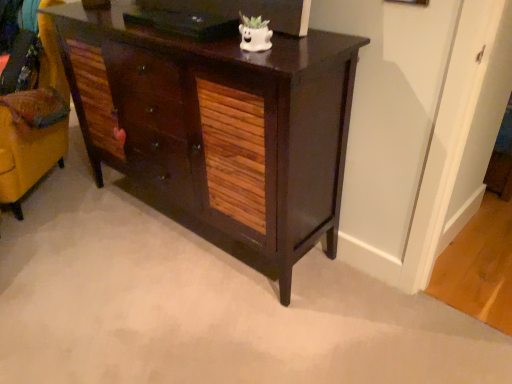
This screenshot has height=384, width=512. In order to click on velvet yellow swivel chair at left in this screenshot , I will do (x=33, y=129).

The width and height of the screenshot is (512, 384). What do you see at coordinates (33, 129) in the screenshot?
I see `velvet yellow swivel chair at left` at bounding box center [33, 129].

Measure the distance between point (x=9, y=138) and camera.

A distance of 6.69 feet exists between point (x=9, y=138) and camera.

Describe the element at coordinates (218, 122) in the screenshot. I see `dark wood cabinet at center` at that location.

Measure the distance between point (x=277, y=97) and camera.

Point (x=277, y=97) is 1.30 meters away from camera.

This screenshot has height=384, width=512. Find the location of `dark wood cabinet at center`. dark wood cabinet at center is located at coordinates (218, 122).

This screenshot has height=384, width=512. Find the location of `velvet yellow swivel chair at left`. velvet yellow swivel chair at left is located at coordinates (33, 129).

Does velvet yellow swivel chair at left appear on the right side of dark wood cabinet at center?

No.

Who is more distant, velvet yellow swivel chair at left or dark wood cabinet at center?

velvet yellow swivel chair at left is further away from the camera.

Does point (62, 87) come farther from viewer compared to point (159, 173)?

Yes, point (62, 87) is behind point (159, 173).

From the image's perspective, between velvet yellow swivel chair at left and dark wood cabinet at center, who is located below?

dark wood cabinet at center appears lower in the image.

From a real-world perspective, is velvet yellow swivel chair at left physically below dark wood cabinet at center?

Yes, from a real-world perspective, velvet yellow swivel chair at left is under dark wood cabinet at center.

Is velvet yellow swivel chair at left wider than dark wood cabinet at center?

Correct, the width of velvet yellow swivel chair at left exceeds that of dark wood cabinet at center.

Is velvet yellow swivel chair at left taller than dark wood cabinet at center?

Yes, velvet yellow swivel chair at left is taller than dark wood cabinet at center.

Is velvet yellow swivel chair at left bigger or smaller than dark wood cabinet at center?

velvet yellow swivel chair at left is smaller than dark wood cabinet at center.

Is velvet yellow swivel chair at left surrounding dark wood cabinet at center?

No, dark wood cabinet at center is not surrounded by velvet yellow swivel chair at left.

Are velvet yellow swivel chair at left and dark wood cabinet at center far apart?

Actually, velvet yellow swivel chair at left and dark wood cabinet at center are a little close together.

Consider the image. Does velvet yellow swivel chair at left turn towards dark wood cabinet at center?

No, velvet yellow swivel chair at left does not turn towards dark wood cabinet at center.

Can you tell me how much velvet yellow swivel chair at left and dark wood cabinet at center differ in facing direction?

The angular difference between velvet yellow swivel chair at left and dark wood cabinet at center is 35.2 degrees.

At what (x,y) coordinates should I click in order to perform the action: click on swivel chair above the dark wood cabinet at center (from the image's perspective). Please return your answer as a coordinate pair (x, y). Looking at the image, I should click on (33, 129).

Based on the photo, can you confirm if dark wood cabinet at center is positioned to the left of velvet yellow swivel chair at left?

No, dark wood cabinet at center is not to the left of velvet yellow swivel chair at left.

Which object is closer to the camera, dark wood cabinet at center or velvet yellow swivel chair at left?

dark wood cabinet at center is in front.

Based on the photo, which is farther, (x=65, y=23) or (x=64, y=147)?

The point (x=64, y=147) is behind.

From the image's perspective, is dark wood cabinet at center below velvet yellow swivel chair at left?

Indeed, from the image's perspective, dark wood cabinet at center is shown beneath velvet yellow swivel chair at left.

From a real-world perspective, is dark wood cabinet at center physically above velvet yellow swivel chair at left?

Yes, from a real-world perspective, dark wood cabinet at center is on top of velvet yellow swivel chair at left.

Considering the sizes of objects dark wood cabinet at center and velvet yellow swivel chair at left in the image provided, who is thinner, dark wood cabinet at center or velvet yellow swivel chair at left?

dark wood cabinet at center.

Considering the relative sizes of dark wood cabinet at center and velvet yellow swivel chair at left in the image provided, is dark wood cabinet at center taller than velvet yellow swivel chair at left?

Incorrect, the height of dark wood cabinet at center is not larger of that of velvet yellow swivel chair at left.

From the picture: Who is smaller, dark wood cabinet at center or velvet yellow swivel chair at left?

velvet yellow swivel chair at left.

Is velvet yellow swivel chair at left completely or partially inside dark wood cabinet at center?

Definitely not — velvet yellow swivel chair at left is not inside dark wood cabinet at center.

Is dark wood cabinet at center not near velvet yellow swivel chair at left?

No, dark wood cabinet at center is not far from velvet yellow swivel chair at left.

Could you tell me if dark wood cabinet at center is turned towards velvet yellow swivel chair at left?

No, dark wood cabinet at center is not oriented towards velvet yellow swivel chair at left.

How many degrees apart are the facing directions of dark wood cabinet at center and velvet yellow swivel chair at left?

They differ by 35.2 degrees in their facing directions.

In the image, there is a velvet yellow swivel chair at left. In order to click on the chest of drawers below it (from the image's perspective) in this screenshot , I will do `click(218, 122)`.

This screenshot has width=512, height=384. What are the coordinates of `chest of drawers above the velvet yellow swivel chair at left (from a real-world perspective)` in the screenshot? It's located at (218, 122).

Image resolution: width=512 pixels, height=384 pixels. I want to click on swivel chair located underneath the dark wood cabinet at center (from a real-world perspective), so click(33, 129).